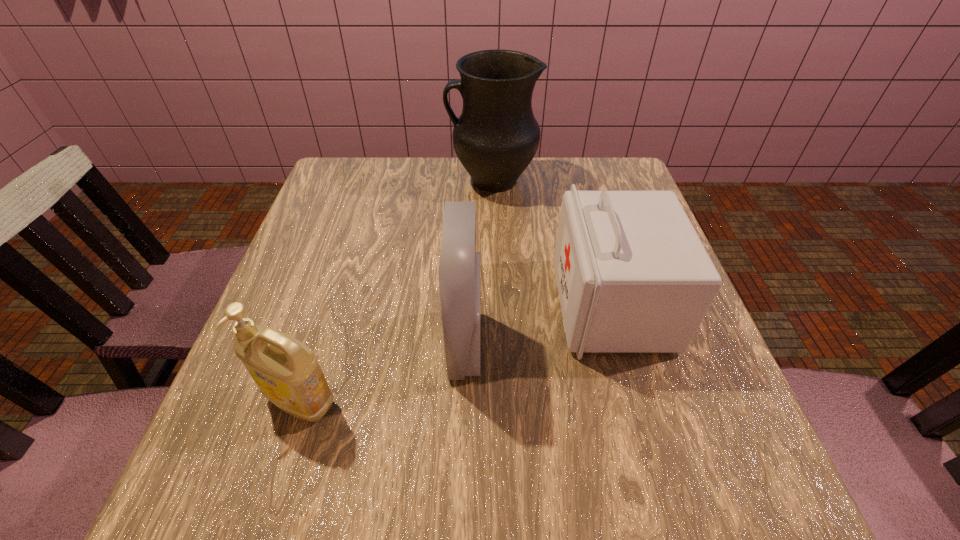
Where is `pitcher`? The image size is (960, 540). pitcher is located at coordinates (496, 137).

Locate an element on the screen. Image resolution: width=960 pixels, height=540 pixels. the left first-aid kit is located at coordinates (459, 267).

You are a GUI agent. You are given a task and a screenshot of the screen. Output one action in this format:
    pyautogui.click(x=<x>, y=<y>)
    Task: Click on the right first-aid kit
    
    Given the screenshot: What is the action you would take?
    pyautogui.click(x=633, y=276)

The image size is (960, 540). Find the location of `the leftmost object`. the leftmost object is located at coordinates (287, 372).

You are a GUI agent. You are given a task and a screenshot of the screen. Output one action in this format:
    pyautogui.click(x=<x>, y=<y>)
    Task: Click on the vacant space located on the handle side of the farthest object
    
    Given the screenshot: What is the action you would take?
    pyautogui.click(x=377, y=180)

You are a GUI agent. You are given a task and a screenshot of the screen. Output one action in this format:
    pyautogui.click(x=<x>, y=<y>)
    Task: Click on the vacant space situated on the handle side of the farthest object
    
    Given the screenshot: What is the action you would take?
    click(367, 180)

Identify the location of vacant point located 0.140m on the handle side of the farthest object. The width and height of the screenshot is (960, 540). [396, 180].

Identify the location of free space located on the front-facing side of the left first-aid kit. (628, 345).

The image size is (960, 540). Identify the location of vacant region located 0.380m on the front-facing side of the rightmost object. (367, 306).

The height and width of the screenshot is (540, 960). I want to click on vacant space located 0.390m on the front-facing side of the rightmost object, so click(x=362, y=306).